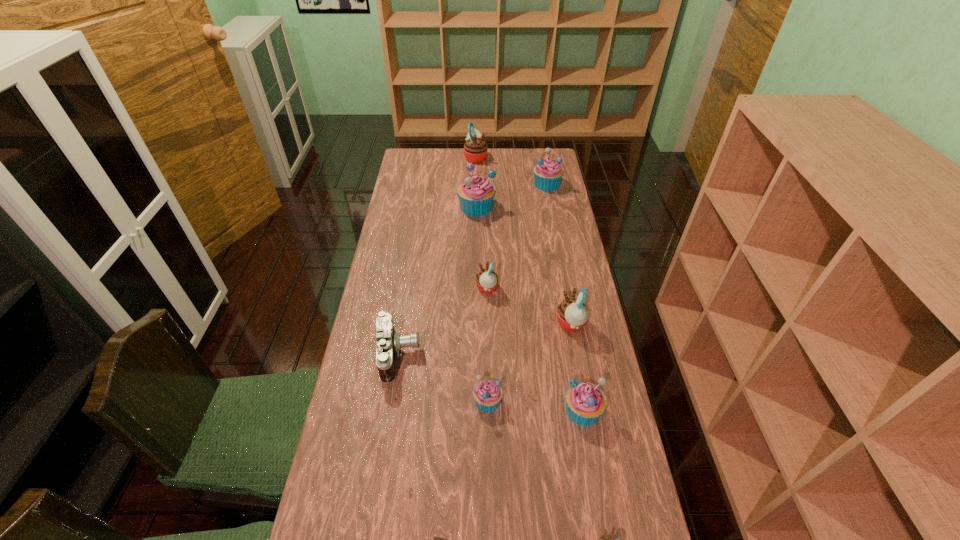
Identify the location of vacant space at the far left corner of the desktop. The height and width of the screenshot is (540, 960). (425, 160).

The width and height of the screenshot is (960, 540). What are the coordinates of `empty space between the fourth farthest muffin and the leftmost object` in the screenshot? It's located at (443, 322).

Identify the location of free area in between the smallest blue muffin and the fourth farthest object. The image size is (960, 540). (488, 345).

Locate an element on the screen. This screenshot has height=540, width=960. free space between the third nearest blue muffin and the smallest blue muffin is located at coordinates (482, 303).

The image size is (960, 540). I want to click on free space between the biggest pink muffin and the third farthest pink muffin, so click(523, 240).

Image resolution: width=960 pixels, height=540 pixels. Find the location of `empty location between the leftmost object and the farthest object`. empty location between the leftmost object and the farthest object is located at coordinates (438, 256).

Locate an element on the screen. empty space that is in between the fourth nearest muffin and the smallest blue muffin is located at coordinates click(x=529, y=362).

Where is `the sixth closest object to the farthest object`? Image resolution: width=960 pixels, height=540 pixels. the sixth closest object to the farthest object is located at coordinates (487, 394).

This screenshot has height=540, width=960. In order to click on object that stands as the ninth closest to the shortest object in this screenshot , I will do `click(475, 149)`.

Select which muffin appears as the sixth closest to the biggest blue muffin. Please provide its 2D coordinates. Your answer should be formatted as a tuple, i.e. [(x, y)], where the tuple contains the x and y coordinates of a point satisfying the conditions above.

[(585, 402)]